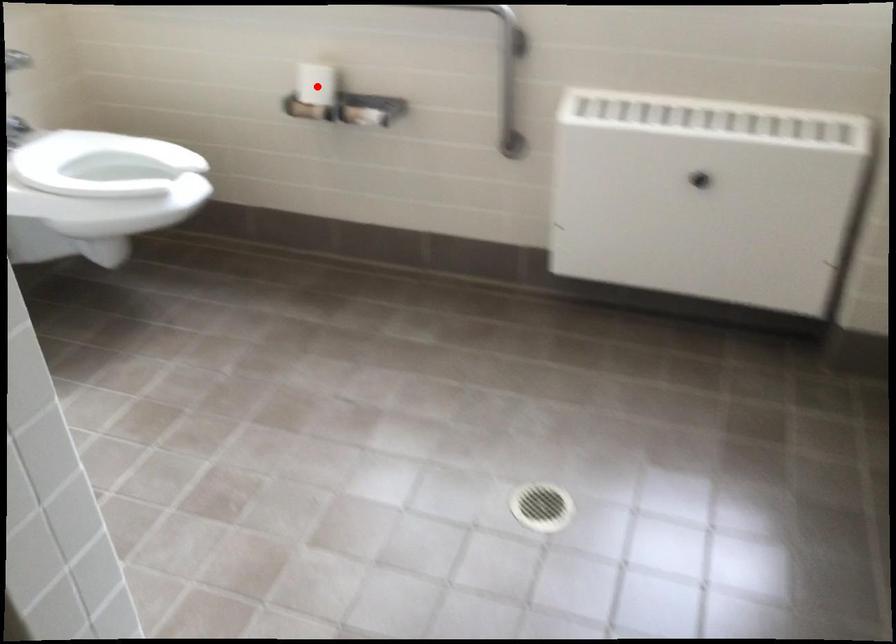
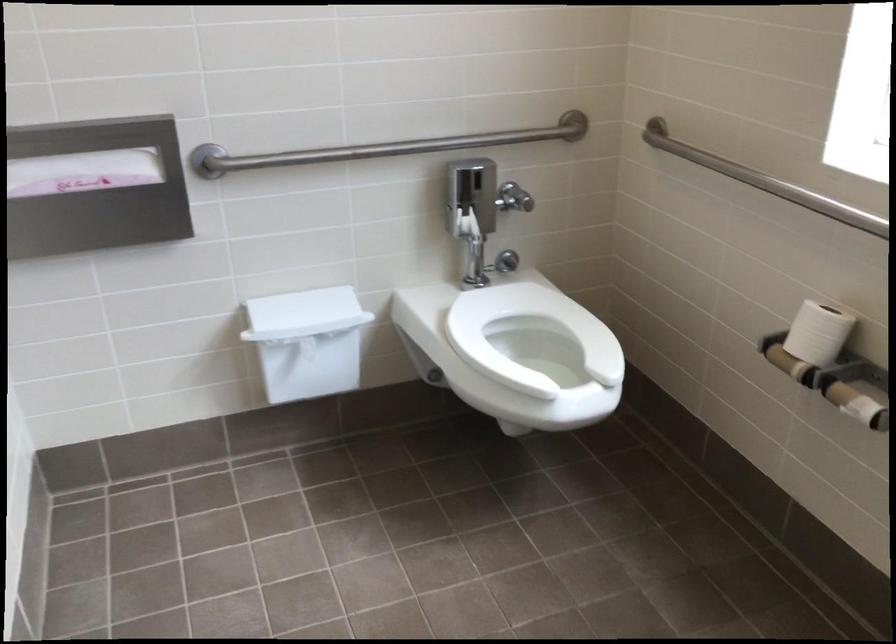
Question: A red point is marked in image1. In image2, is the corresponding 3D point closer to the camera or farther? Reply with the corresponding letter.

Choices:
 (A) The corresponding 3D point is closer.
 (B) The corresponding 3D point is farther.

Answer: (A)